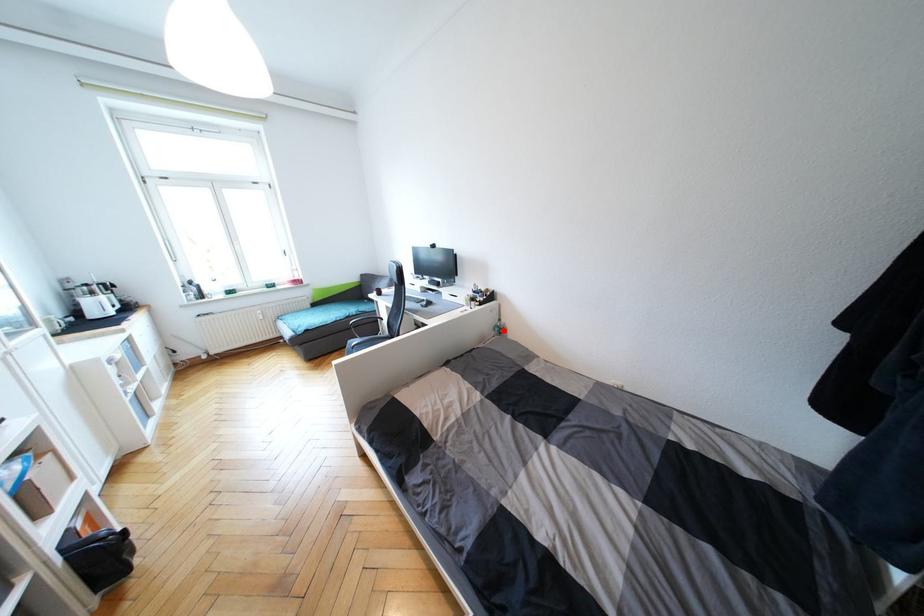
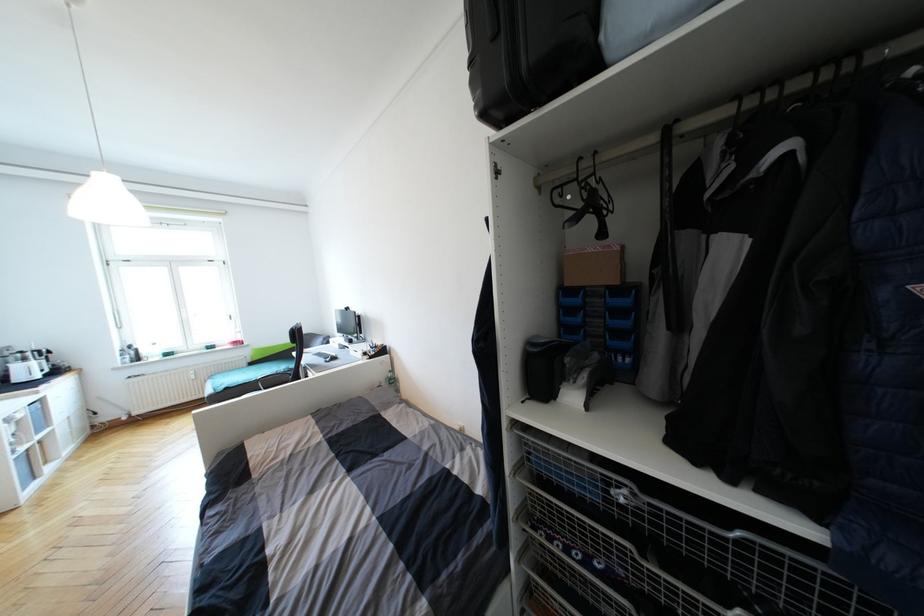
The point at the highlighted location is marked in the first image. Where is the corresponding point in the second image?

(395, 382)